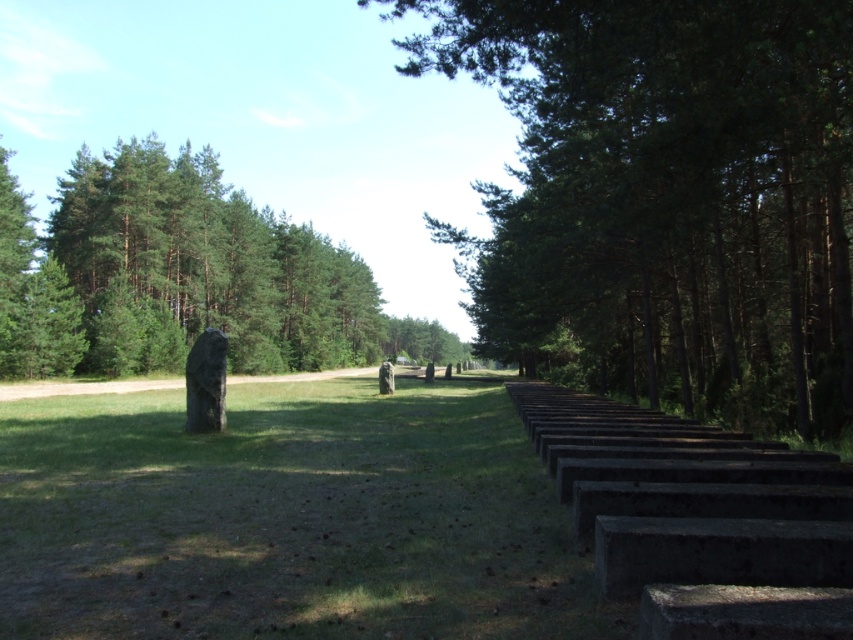
Between green leafy trees at center and green matte tree at left, which one appears on the right side from the viewer's perspective?

Positioned to the right is green leafy trees at center.

Is point (773, 81) farther from viewer compared to point (349, 324)?

No.

In order to click on green leafy trees at center in this screenshot , I will do `click(665, 196)`.

Does green grass at center lie behind green matte tree at left?

No.

Measure the distance between green grass at center and camera.

green grass at center is 13.82 feet away from camera.

Who is more distant from viewer, (465, 426) or (370, 349)?

The point (370, 349) is behind.

Find the location of a particular element. This screenshot has width=853, height=640. green grass at center is located at coordinates (288, 518).

In the scene shown: Does green leafy trees at center have a lesser width compared to green grass at center?

No.

Based on the photo, can you confirm if green leafy trees at center is smaller than green grass at center?

Incorrect, green leafy trees at center is not smaller in size than green grass at center.

Where is `green leafy trees at center`? green leafy trees at center is located at coordinates (665, 196).

In order to click on green leafy trees at center in this screenshot , I will do `click(665, 196)`.